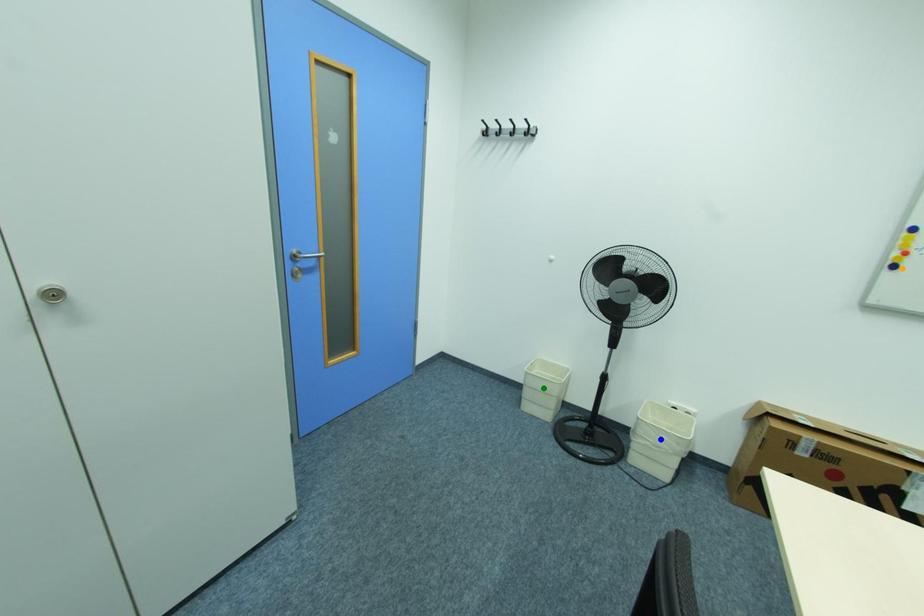
Order these from farthest to nearest:
blue point, green point, orange point

1. green point
2. blue point
3. orange point